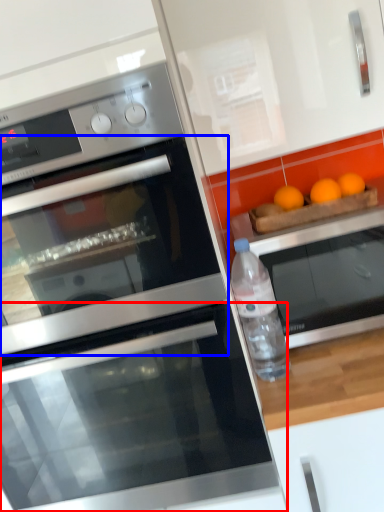
Question: Which object is closer to the camera taking this photo, oven (highlighted by a red box) or oven (highlighted by a blue box)?

Choices:
 (A) oven
 (B) oven

Answer: (B)